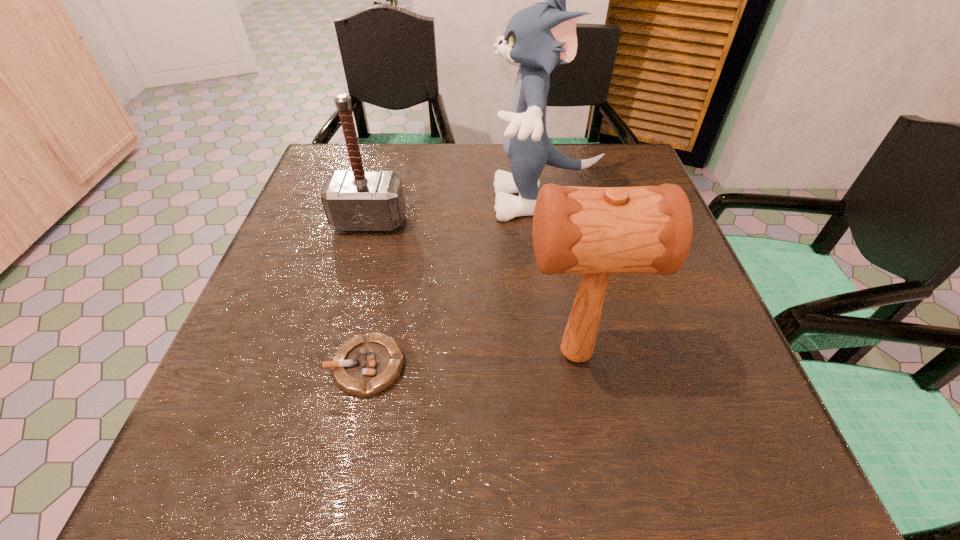
What are the coordinates of `cat` in the screenshot? It's located at (537, 38).

Where is `mallet`? This screenshot has height=540, width=960. mallet is located at coordinates (594, 231).

This screenshot has width=960, height=540. I want to click on hammer, so click(x=359, y=200).

Identify the location of ashtray. (365, 365).

Where is `vacant space located 0.180m on the front-facing side of the tallest object`? The width and height of the screenshot is (960, 540). vacant space located 0.180m on the front-facing side of the tallest object is located at coordinates (419, 200).

You are a GUI agent. You are given a task and a screenshot of the screen. Output one action in this format:
    pyautogui.click(x=<x>, y=<y>)
    Task: Click on the free space located 0.070m on the front-facing side of the tallest object
    This screenshot has width=960, height=540.
    Given the screenshot: What is the action you would take?
    pyautogui.click(x=463, y=200)

Where is `vacant space situated 0.320m on the front-facing side of the tallest object`? vacant space situated 0.320m on the front-facing side of the tallest object is located at coordinates (361, 200).

This screenshot has width=960, height=540. I want to click on vacant space located on the strike surface of the mallet, so click(296, 354).

Where is `vacant space situated on the strike surface of the mallet`? The image size is (960, 540). vacant space situated on the strike surface of the mallet is located at coordinates (342, 354).

Identify the location of free location located on the strike surface of the mallet. Image resolution: width=960 pixels, height=540 pixels. click(x=371, y=354).